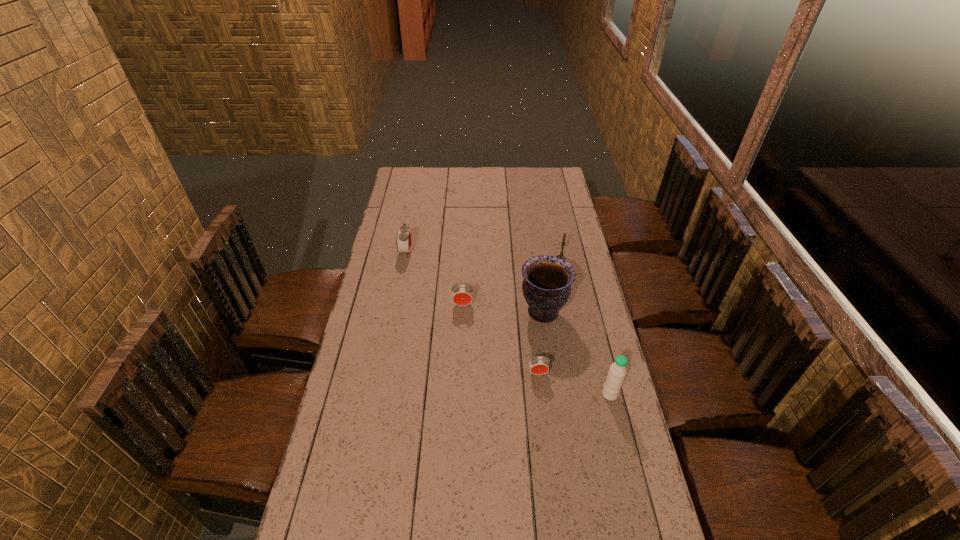
You are a GUI agent. You are given a task and a screenshot of the screen. Output one action in this format:
    pyautogui.click(x=<x>, y=<y>)
    Task: Click on the empty space that is in between the pottery and the shortest alarm clock
    Image resolution: width=960 pixels, height=540 pixels.
    Given the screenshot: What is the action you would take?
    pyautogui.click(x=540, y=343)

Identify the location of empty location between the shortest alarm clock and the pottery. The width and height of the screenshot is (960, 540). tap(540, 343).

Identify the location of free point between the candle and the farthest alarm clock. (483, 255).

You are a GUI agent. You are given a task and a screenshot of the screen. Output one action in this format:
    pyautogui.click(x=<x>, y=<y>)
    Task: Click on the empty location between the fifth farthest object and the second alarm clock from left to right
    
    Given the screenshot: What is the action you would take?
    pyautogui.click(x=500, y=339)

Locate an element on the screen. vacant area between the shortest alarm clock and the water bottle is located at coordinates (574, 383).

The width and height of the screenshot is (960, 540). In order to click on vacant space that is in between the second alarm clock from right to left and the rightmost alarm clock in this screenshot , I will do `click(500, 339)`.

Choose which object is the second nearest neighbor to the candle. Please provide its 2D coordinates. Your answer should be formatted as a tuple, i.e. [(x, y)], where the tuple contains the x and y coordinates of a point satisfying the conditions above.

[(462, 295)]

At what (x,y) coordinates should I click in order to perform the action: click on object that is the second closest to the second nearest object. Please return your answer as a coordinate pair (x, y). This screenshot has height=540, width=960. Looking at the image, I should click on (615, 378).

Select which alarm clock is the third closest to the candle. Please provide its 2D coordinates. Your answer should be formatted as a tuple, i.e. [(x, y)], where the tuple contains the x and y coordinates of a point satisfying the conditions above.

[(403, 240)]

Identify which alarm clock is the closest to the shortest object. Please provide its 2D coordinates. Your answer should be formatted as a tuple, i.e. [(x, y)], where the tuple contains the x and y coordinates of a point satisfying the conditions above.

[(462, 295)]